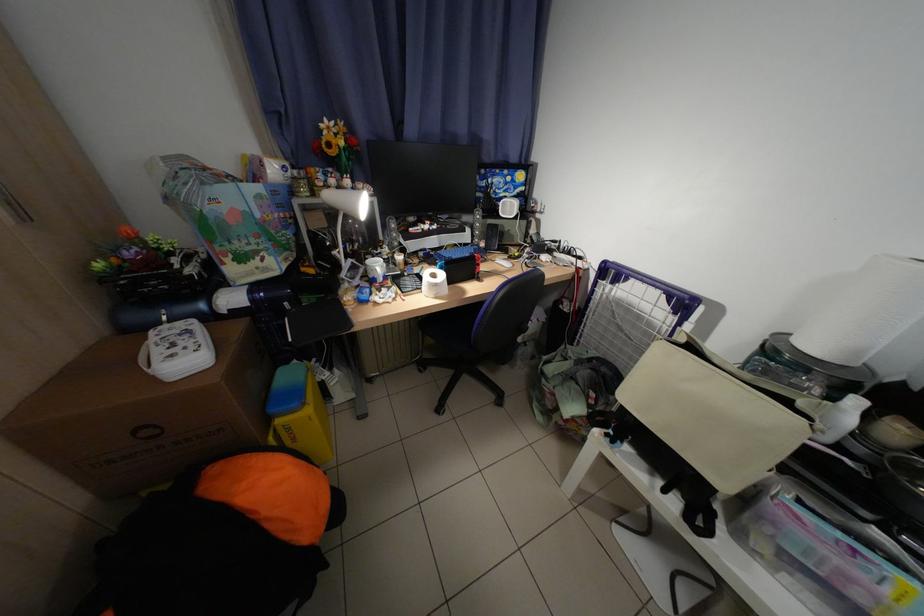
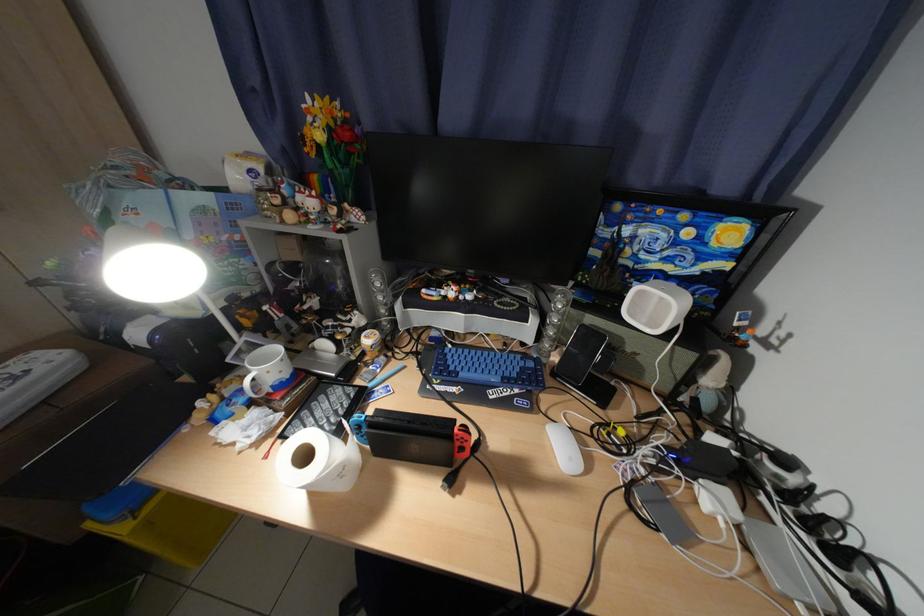
Locate, in the second image, the point that corresponds to (354,144) in the first image.

(331, 138)